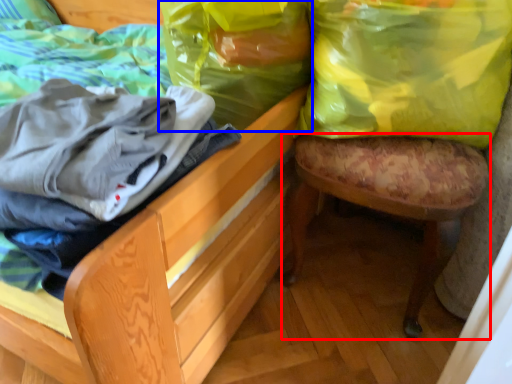
Question: Which object is closer to the camera taking this photo, stool (highlighted by a red box) or shopping bag (highlighted by a blue box)?

Choices:
 (A) stool
 (B) shopping bag

Answer: (A)